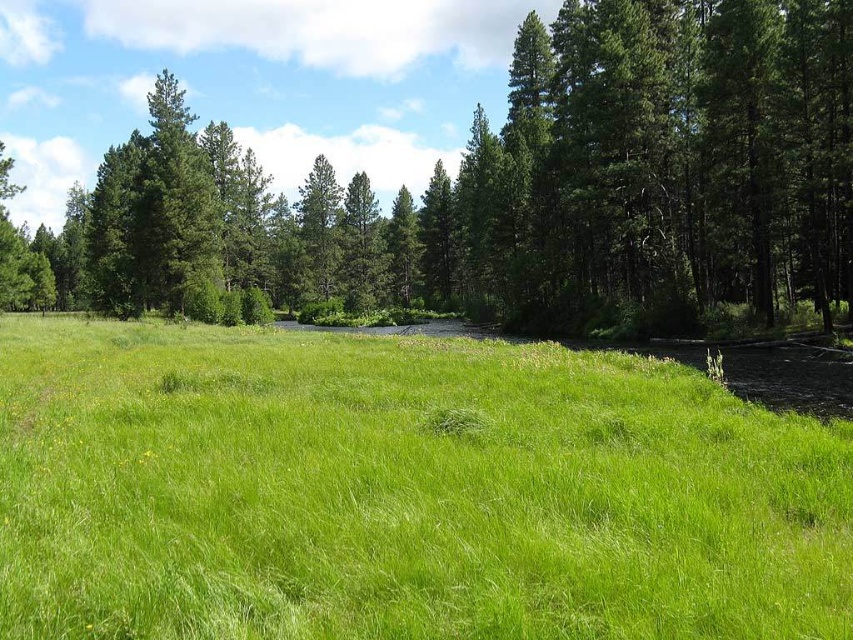
From the picture: Based on the scene description, where is the point located at coordinates (402, 492)?

The point at coordinates (402, 492) is located on the green grassy area at center.

You are a gardener planning to mow the green grassy at center and trim the green leafy tree at center. Which task requires more horizontal space to perform the work?

The green leafy tree at center requires more horizontal space since its width is greater than the green grassy at center.